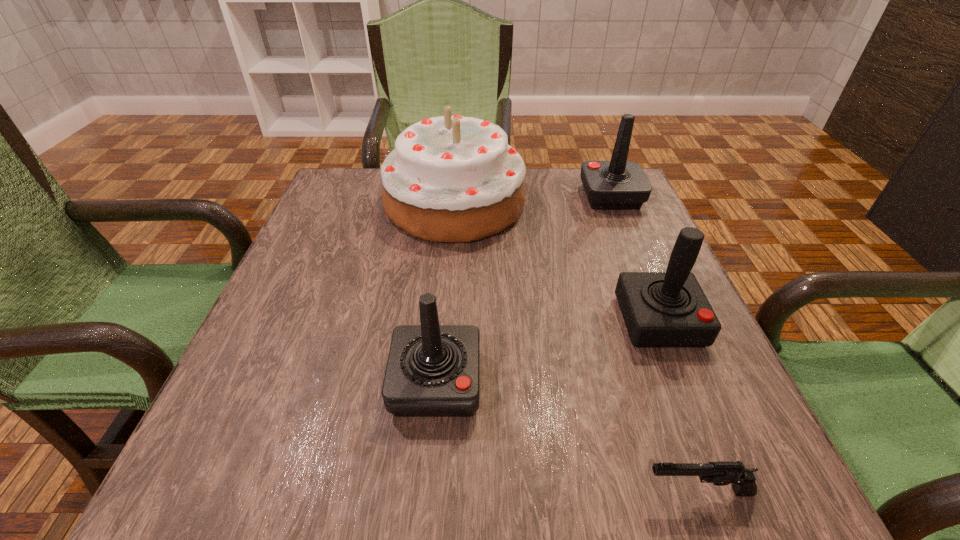
This screenshot has width=960, height=540. Find the location of `free space located 0.200m at the end of the barrel of the gun`. free space located 0.200m at the end of the barrel of the gun is located at coordinates tap(495, 491).

Locate an element on the screen. This screenshot has height=540, width=960. cake that is at the far edge is located at coordinates (450, 178).

Locate an element on the screen. joystick positioned at the far edge is located at coordinates tap(618, 184).

The width and height of the screenshot is (960, 540). What are the coordinates of `object that is at the near edge` in the screenshot? It's located at click(721, 473).

Locate an element on the screen. The image size is (960, 540). gun that is at the right edge is located at coordinates (721, 473).

I want to click on object at the far right corner, so click(x=618, y=184).

The image size is (960, 540). Identify the location of object located at the near right corner. (721, 473).

The image size is (960, 540). What are the coordinates of `vacant space at the far edge` in the screenshot? It's located at (550, 190).

In the image, there is a desktop. Identify the location of vacant region at the near edge. (424, 481).

This screenshot has height=540, width=960. What are the coordinates of `free space at the left edge` in the screenshot? It's located at (277, 310).